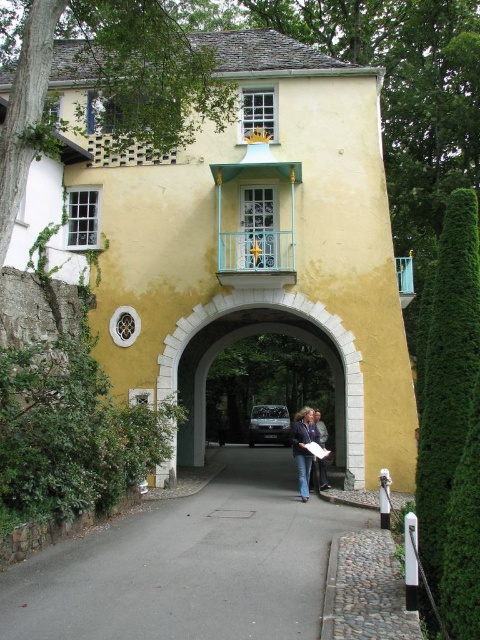
Question: Observing the image, what is the correct spatial positioning of white stone archway at center in reference to light brown leather jacket at center?

Choices:
 (A) above
 (B) below

Answer: (A)

Question: Is green leafy hedge at right to the right of white stone archway at center from the viewer's perspective?

Choices:
 (A) yes
 (B) no

Answer: (A)

Question: Which point is farther to the camera?

Choices:
 (A) light brown leather jacket at center
 (B) green leafy hedge at right
 (C) white stone archway at center

Answer: (C)

Question: Which point is closer to the camera taking this photo?

Choices:
 (A) (304, 410)
 (B) (320, 433)
 (C) (190, 365)

Answer: (A)

Question: Which is nearer to the light brown leather jacket at center?

Choices:
 (A) green leafy hedge at right
 (B) dark blue jeans at center
 (C) white stone archway at center

Answer: (B)

Question: Is dark blue jeans at center positioned at the back of light brown leather jacket at center?

Choices:
 (A) yes
 (B) no

Answer: (B)